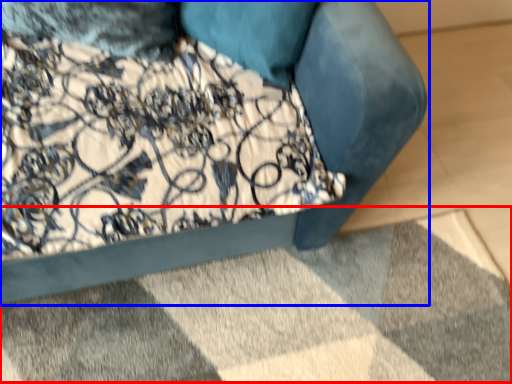
Question: Which of the following is the farthest to the observer, mat (highlighted by a red box) or furniture (highlighted by a blue box)?

Choices:
 (A) mat
 (B) furniture

Answer: (A)